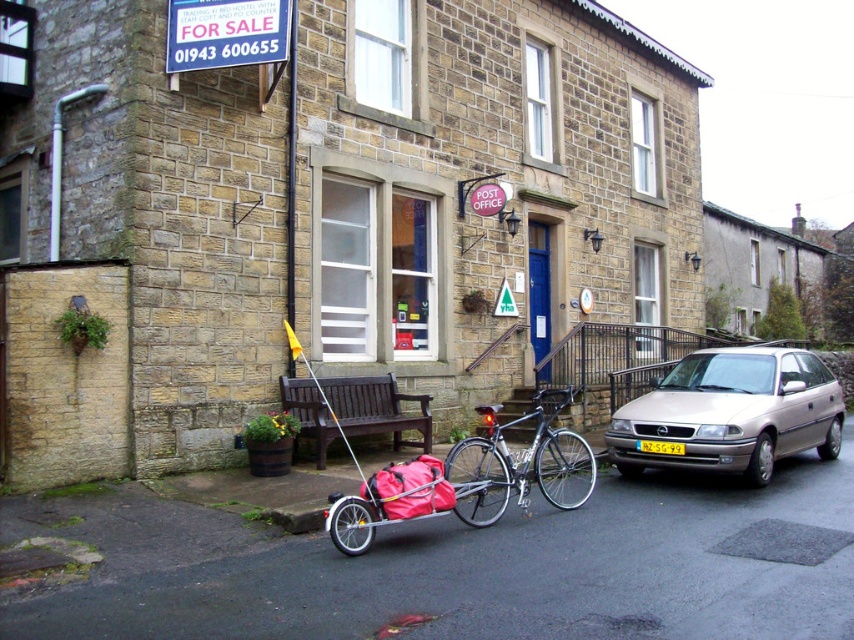
Question: Estimate the real-world distances between objects in this image. Which object is farther from the shiny metallic bicycle at center?

Choices:
 (A) yellow plastic license plate at center
 (B) silver metallic hatchback at right

Answer: (B)

Question: Considering the relative positions of silver metallic hatchback at right and brown wooden bench at center in the image provided, where is silver metallic hatchback at right located with respect to brown wooden bench at center?

Choices:
 (A) below
 (B) above

Answer: (B)

Question: Is silver metallic hatchback at right closer to camera compared to yellow plastic license plate at center?

Choices:
 (A) yes
 (B) no

Answer: (A)

Question: Which of the following is the closest to the observer?

Choices:
 (A) silver metallic hatchback at right
 (B) shiny metallic bicycle at center

Answer: (B)

Question: Where is silver metallic hatchback at right located in relation to shiny metallic bicycle at center in the image?

Choices:
 (A) right
 (B) left

Answer: (A)

Question: Which point is closer to the camera?

Choices:
 (A) (646, 449)
 (B) (411, 422)
 (C) (564, 499)
 (D) (624, 416)

Answer: (C)